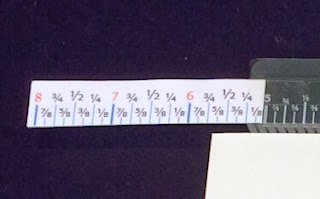
This screenshot has width=320, height=199. I want to click on another ruler, dark gray, so click(292, 91).